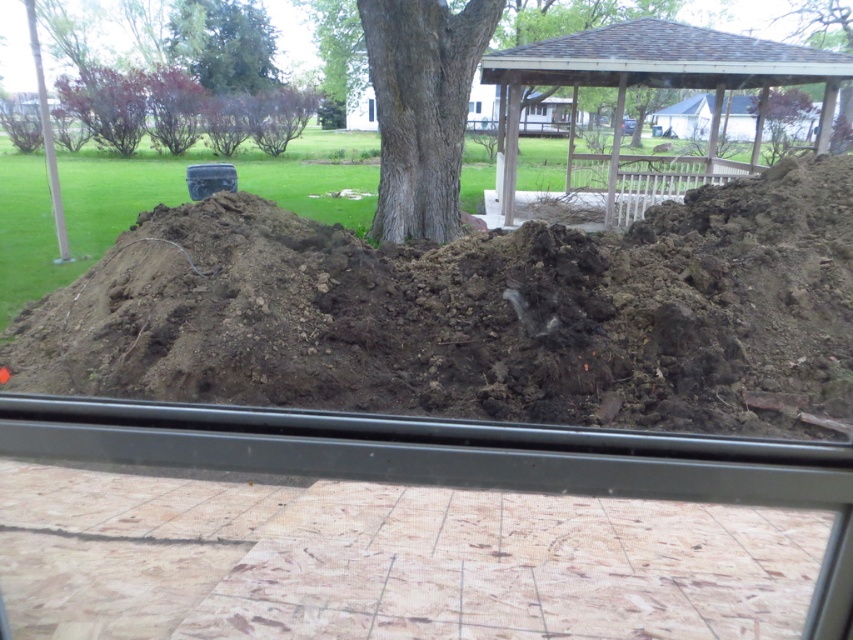
What are the coordinates of the gray textured bark tree at center in the image?

The gray textured bark tree at center is located at coordinates point (x=421, y=108).

You are standing inside a building and looking through the transparent glass window at center. You notice the gray textured bark tree at center outside. Is the tree positioned above or below the window?

The gray textured bark tree at center is located below the transparent glass window at center, so the tree is positioned below the window.